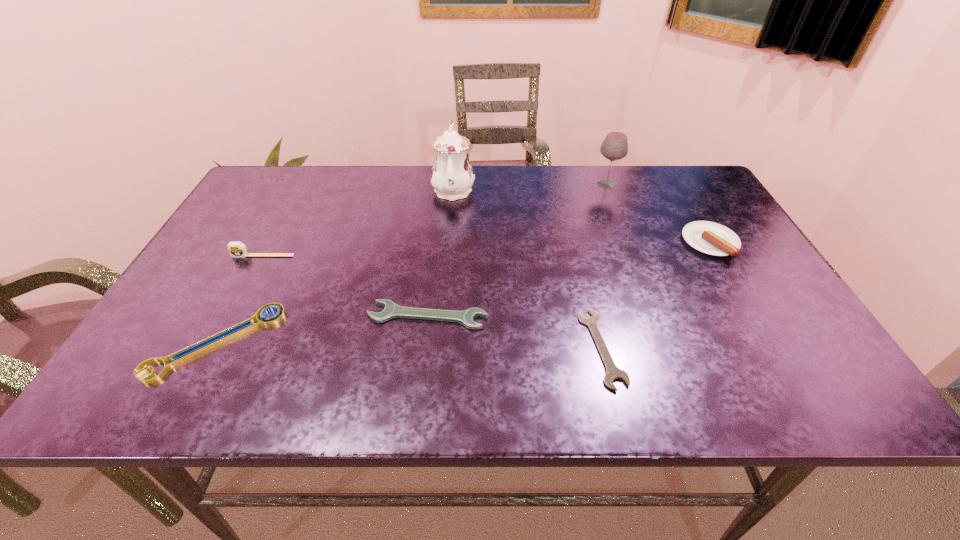
The image size is (960, 540). I want to click on object that is at the right edge, so click(711, 238).

At what (x,y) coordinates should I click in order to perform the action: click on object that is at the near left corner. Please return your answer as a coordinate pair (x, y). Looking at the image, I should click on (228, 334).

Image resolution: width=960 pixels, height=540 pixels. In order to click on free space at the far edge in this screenshot , I will do `click(571, 209)`.

The image size is (960, 540). In the image, there is a desktop. In order to click on free space at the near edge in this screenshot , I will do `click(703, 382)`.

Image resolution: width=960 pixels, height=540 pixels. In the image, there is a desktop. Identify the location of free space at the left edge. (223, 237).

This screenshot has width=960, height=540. I want to click on vacant space that's between the shortest object and the wineglass, so click(x=604, y=266).

I want to click on vacant space that is in between the leftmost wrench and the sausage, so click(x=463, y=293).

The height and width of the screenshot is (540, 960). I want to click on empty location between the shortest wrench and the tallest object, so click(x=528, y=269).

The image size is (960, 540). Identify the location of free space between the tape measure and the sausage. (487, 249).

Locate an element on the screen. The image size is (960, 540). free spot between the shortest wrench and the leftmost wrench is located at coordinates (409, 346).